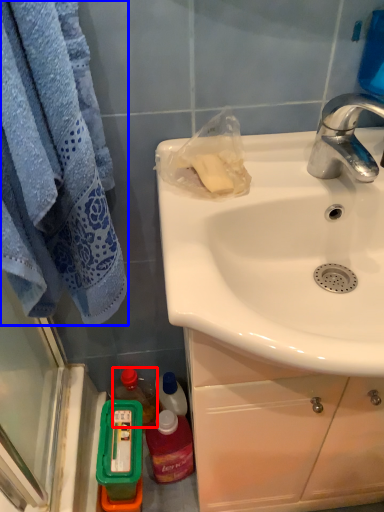
Question: Which of the following is the farthest to the observer, bottle (highlighted by a red box) or towel/napkin (highlighted by a blue box)?

Choices:
 (A) bottle
 (B) towel/napkin

Answer: (A)